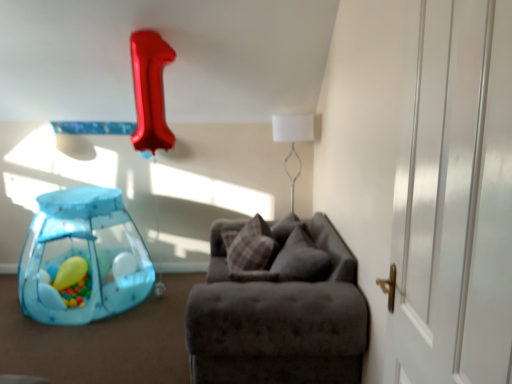
Question: From a real-world perspective, relative to suede-like gray couch at center, is velvet gray pillow at center, arranged as the second pillow when viewed from the left, vertically above or below?

Choices:
 (A) below
 (B) above

Answer: (B)

Question: Considering their positions, is velvet gray pillow at center, which is the first pillow in right-to-left order, located in front of or behind suede-like gray couch at center?

Choices:
 (A) behind
 (B) front

Answer: (A)

Question: Estimate the real-world distances between objects in this image. Which object is farther from the white fabric lampshade at upper center?

Choices:
 (A) suede-like gray couch at center
 (B) velvet gray pillow at center, which is the first pillow in right-to-left order
 (C) plaid fabric pillow at center, the 1th pillow positioned from the left
 (D) white glossy door at right
 (E) translucent yellow balloon at lower left

Answer: (D)

Question: Which of these objects is positioned farthest from the transparent plastic playpen at lower left?

Choices:
 (A) white glossy door at right
 (B) suede-like gray couch at center
 (C) translucent yellow balloon at lower left
 (D) velvet gray pillow at center, which is the first pillow in right-to-left order
 (E) plaid fabric pillow at center, the 1th pillow positioned from the left

Answer: (A)